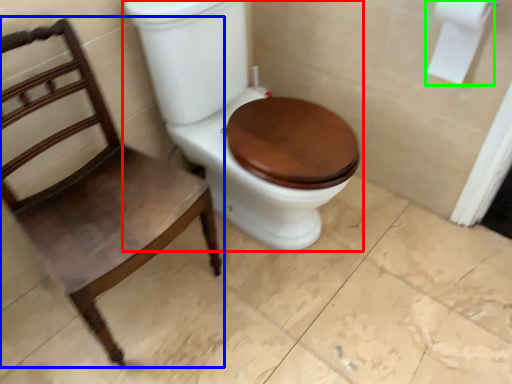
Question: Based on their relative distances, which object is farther from toilet (highlighted by a red box)? Choose from chair (highlighted by a blue box) and toilet paper (highlighted by a green box).

Choices:
 (A) chair
 (B) toilet paper

Answer: (B)